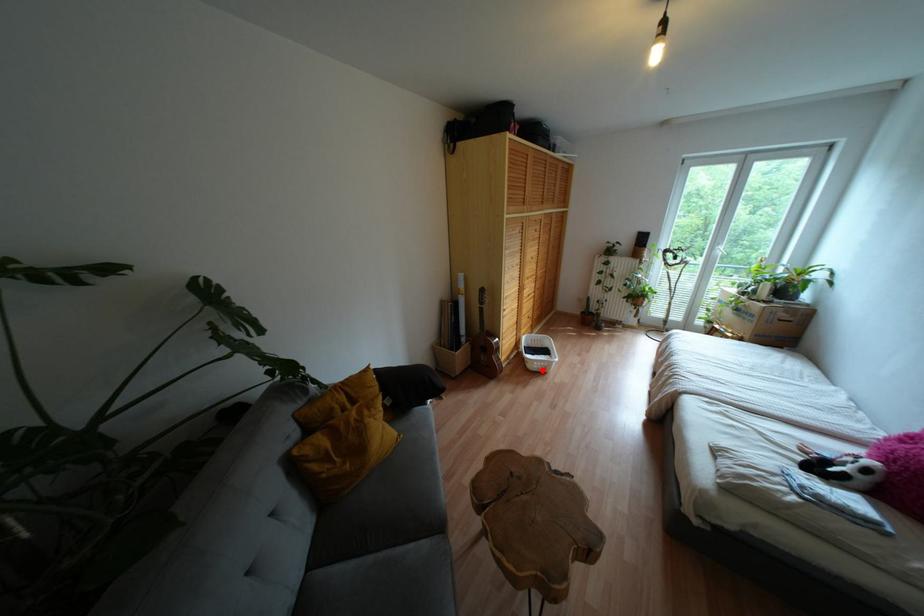
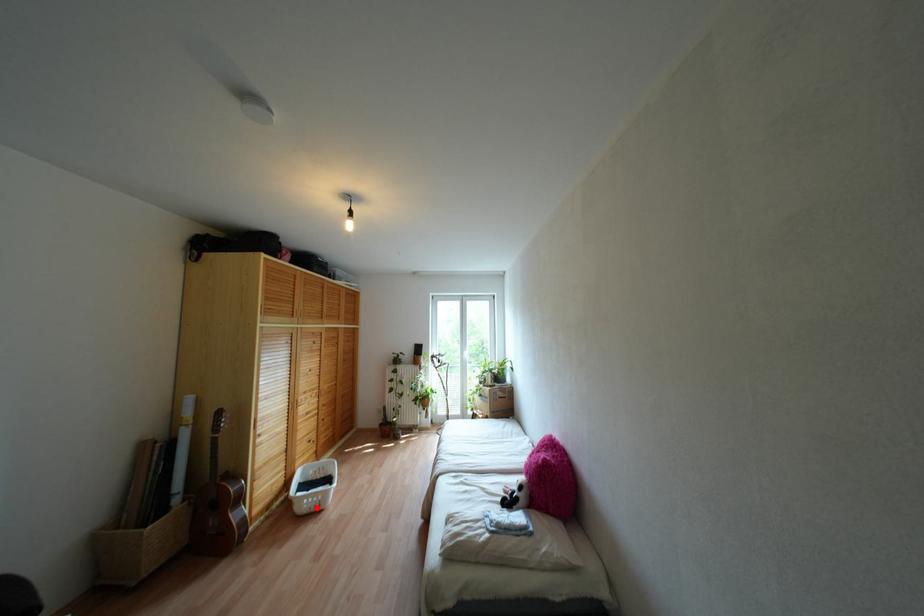
I am providing you with two images of the same scene from different viewpoints. A red point is marked on the first image and another point is marked on the second image. Does the point marked in image1 correspond to the same location as the one in image2?

Yes